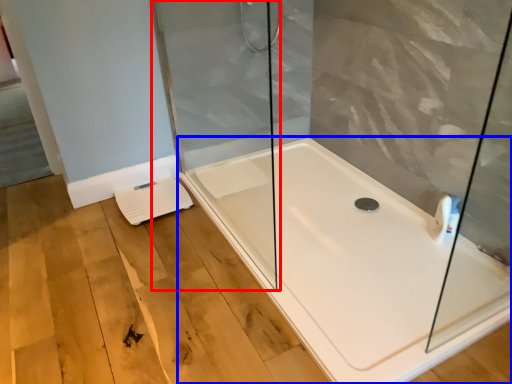
Question: Among these objects, which one is nearest to the camera, shower door (highlighted by a red box) or bathtub (highlighted by a blue box)?

Choices:
 (A) shower door
 (B) bathtub

Answer: (B)